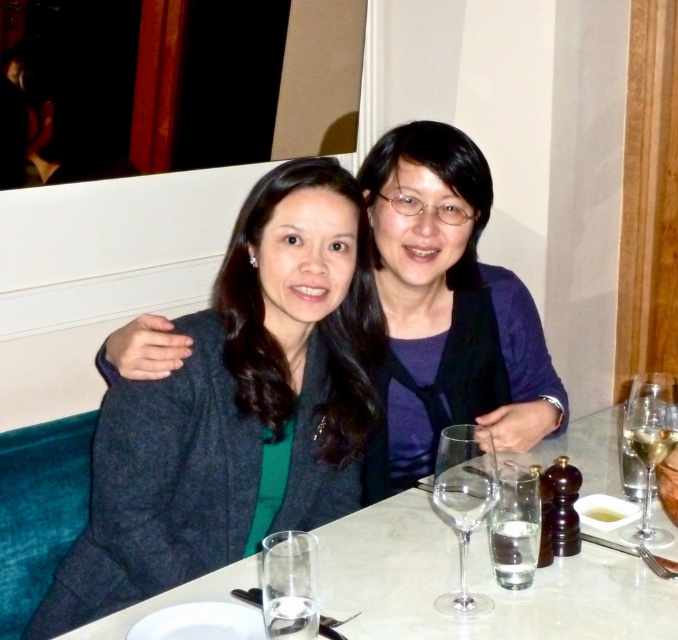
Which is more to the right, matte gray blazer at center or matte black blazer at center?

From the viewer's perspective, matte black blazer at center appears more on the right side.

Between point (214, 400) and point (412, 156), which one is positioned in front?

Point (214, 400) is in front.

At what (x,y) coordinates should I click in order to perform the action: click on matte gray blazer at center. Please return your answer as a coordinate pair (x, y). Looking at the image, I should click on (237, 406).

Does matte black blazer at center have a larger size compared to clear glass at lower center?

Correct, matte black blazer at center is larger in size than clear glass at lower center.

Is point (407, 438) positioned in front of point (279, 630)?

That is False.

I want to click on matte black blazer at center, so click(x=447, y=310).

Does white marble table at center have a greater height compared to clear glass at lower center?

Indeed, white marble table at center has a greater height compared to clear glass at lower center.

Is white marble table at center to the right of clear glass at lower center from the viewer's perspective?

Correct, you'll find white marble table at center to the right of clear glass at lower center.

The height and width of the screenshot is (640, 678). I want to click on white marble table at center, so tap(477, 582).